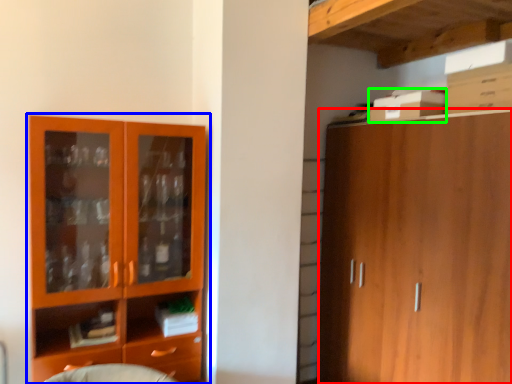
Question: Which object is positioned closest to cabinetry (highlighted by a red box)? Select from cupboard (highlighted by a blue box) and cardboard box (highlighted by a green box).

Choices:
 (A) cupboard
 (B) cardboard box

Answer: (B)